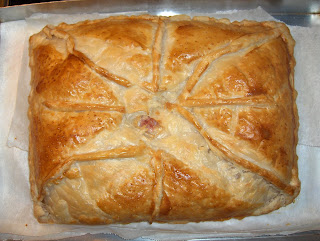
The image size is (320, 241). I want to click on corner, so click(32, 40), click(288, 33), click(289, 198), click(40, 217).